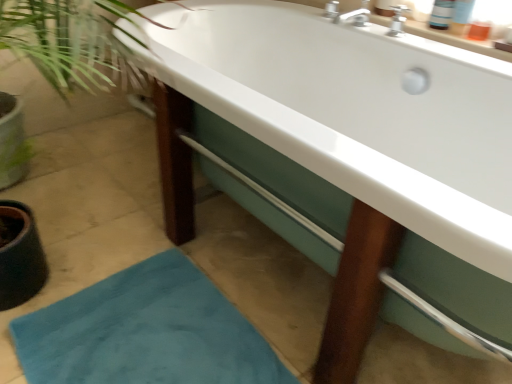
Identify the location of free space above teal plush bath mat at lower left (from a real-world perspective). (136, 347).